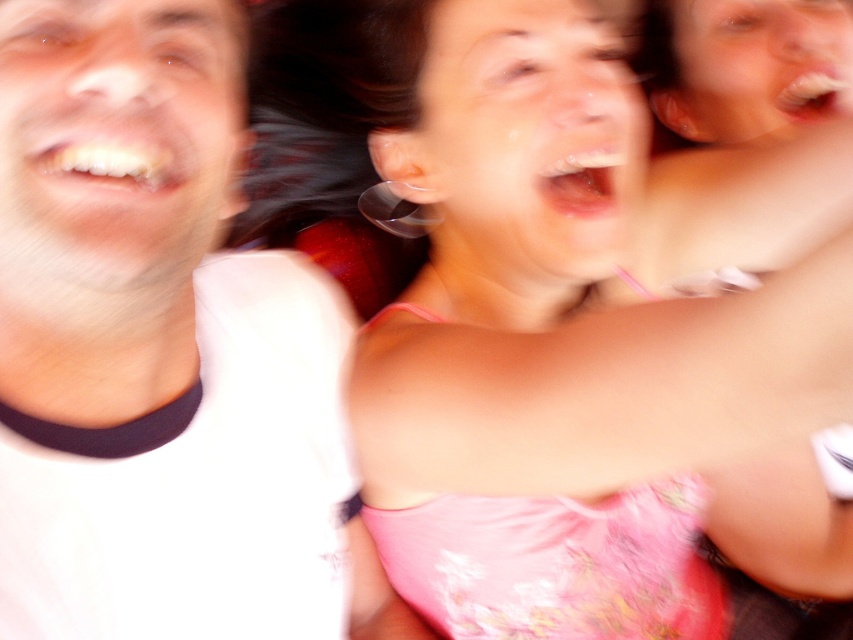
You are standing in front of a photo of three people captured in a lively moment. The photo has two points marked as point 1 at coordinates (77, 440) and point 2 at coordinates (436, 170). If you were to reach out and touch the points on the photo, which point would feel closer to your hand?

Point 1 at coordinates (77, 440) is closer to the viewer than point 2 at coordinates (436, 170), so touching point 1 would feel closer.